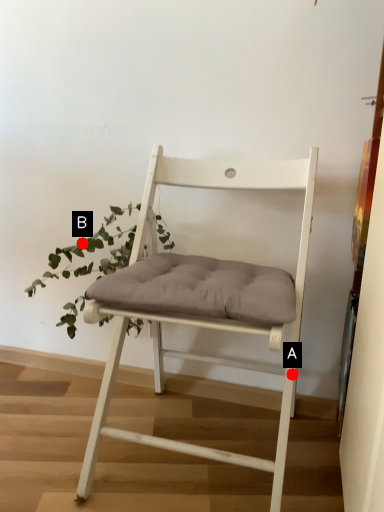
Question: Two points are circled on the image, labeled by A and B beside each circle. Among these points, which one is nearest to the camera?

Choices:
 (A) A is closer
 (B) B is closer

Answer: (A)